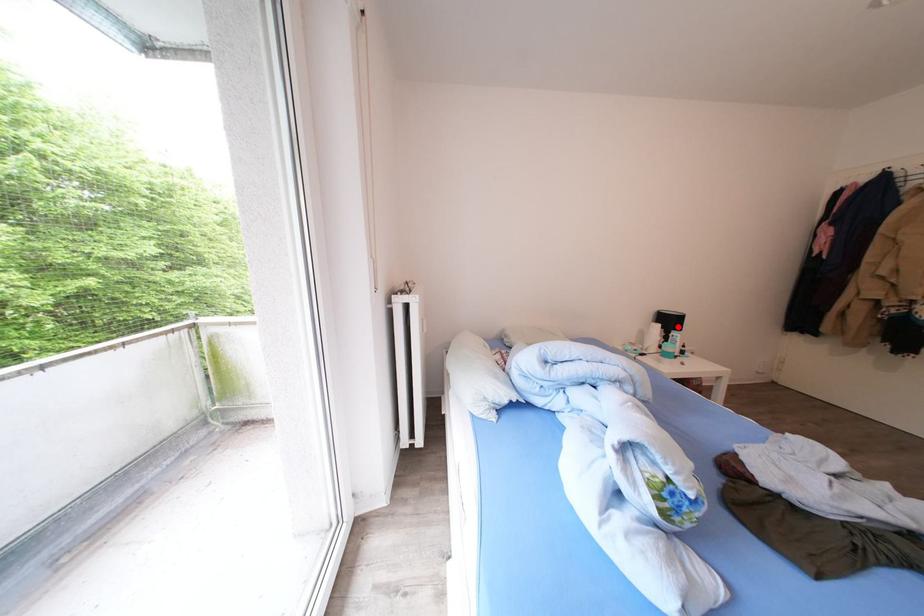
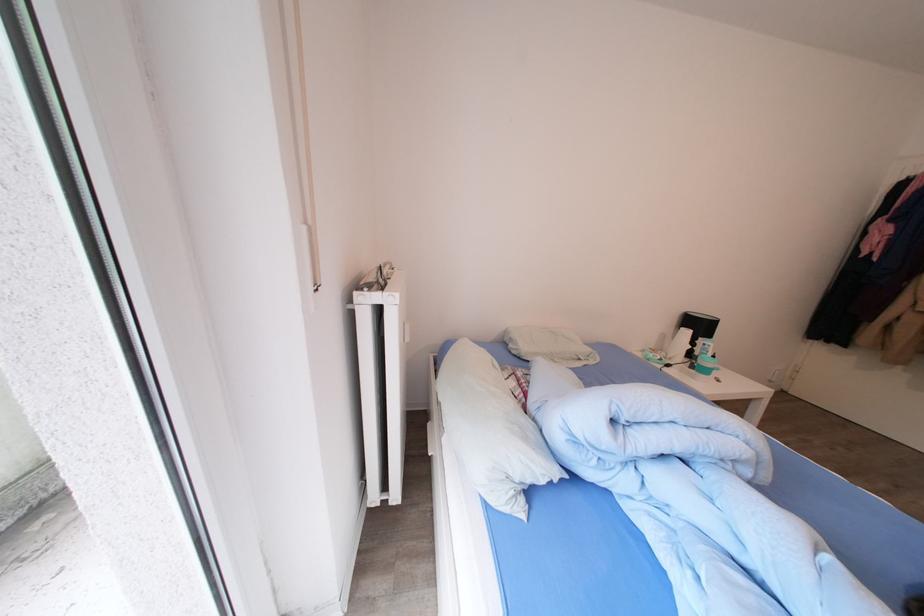
The point at the highlighted location is marked in the first image. Where is the corresponding point in the second image?

(708, 331)